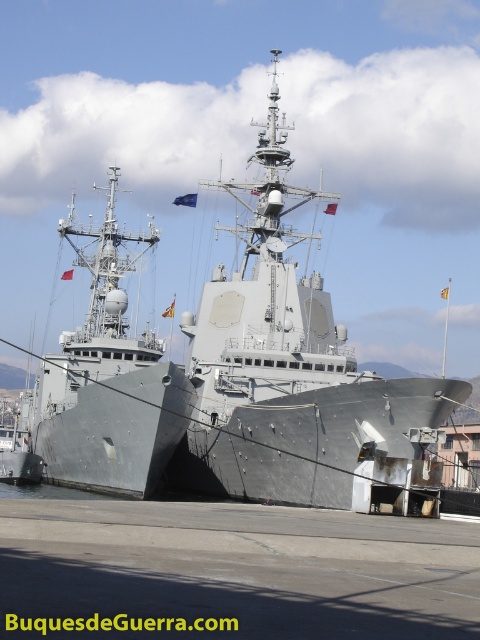
Who is taller, gray metallic ship at center or gray metallic ship at left?

gray metallic ship at center is taller.

Who is positioned more to the right, gray metallic ship at center or gray metallic ship at left?

Positioned to the right is gray metallic ship at center.

Is point (412, 384) behind point (84, 336)?

No.

Where is `gray metallic ship at center`? The image size is (480, 640). gray metallic ship at center is located at coordinates (288, 369).